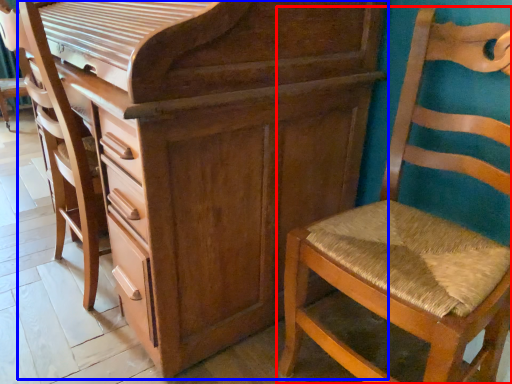
Question: Which point is closer to the camera, chair (highlighted by a red box) or chest of drawers (highlighted by a blue box)?

Choices:
 (A) chair
 (B) chest of drawers

Answer: (A)